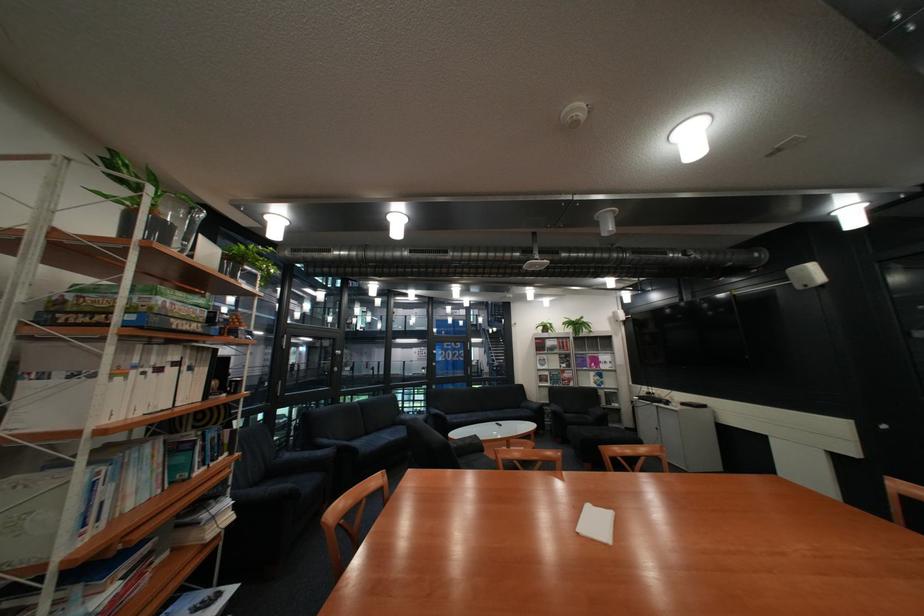
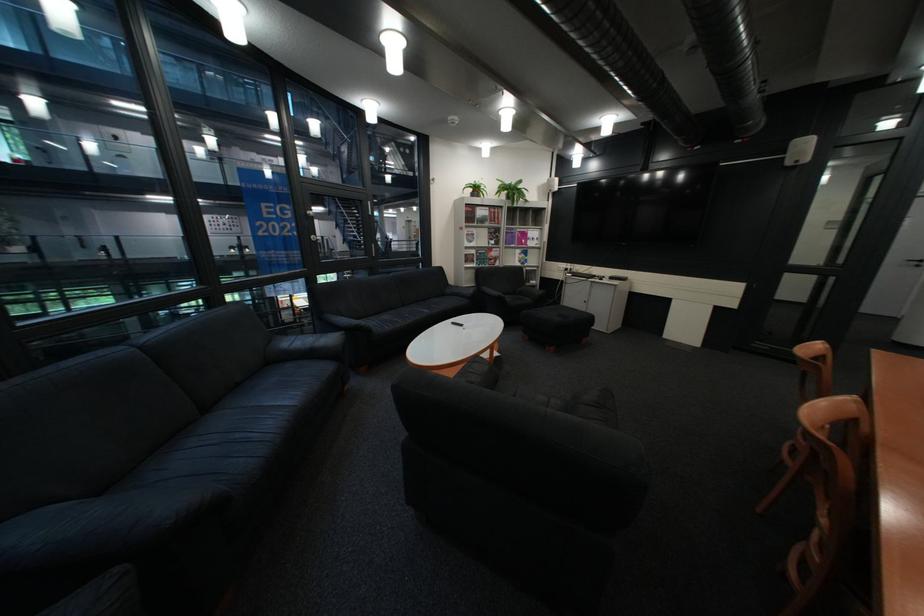
The point at [576,358] is marked in the first image. Where is the corresponding point in the second image?

(505, 233)